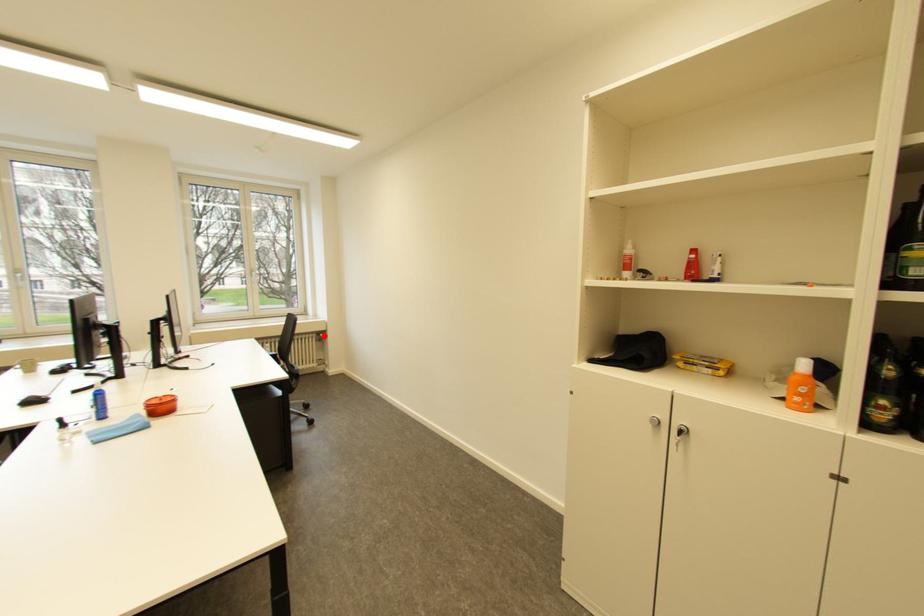
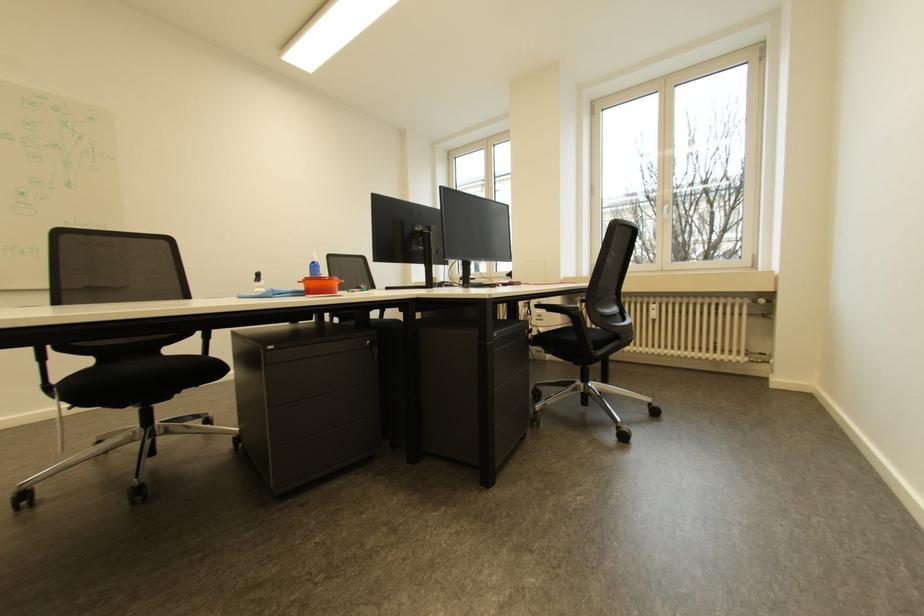
Question: I am providing you with two images of the same scene from different viewpoints. In image1, a red point is highlighted. Considering the same 3D point in image2, which of the following is correct?

Choices:
 (A) It is closer
 (B) It is farther

Answer: (A)